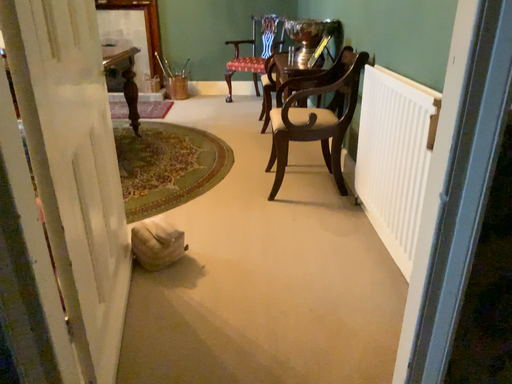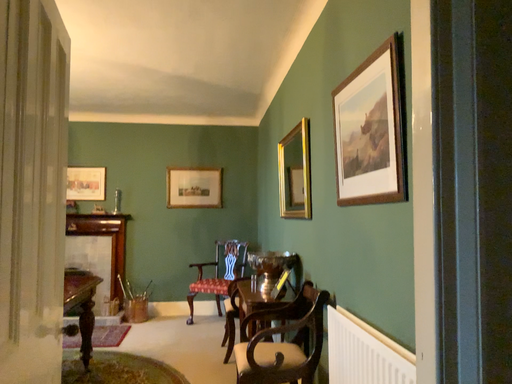
Question: How did the camera likely rotate when shooting the video?

Choices:
 (A) rotated upward
 (B) rotated downward

Answer: (A)